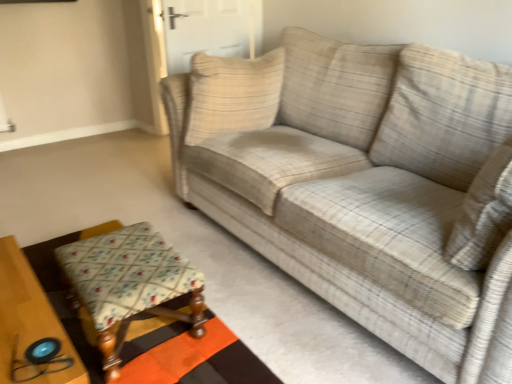
Identify the location of free space above floral fabric stool at lower left (from a real-world perspective). Image resolution: width=512 pixels, height=384 pixels. (128, 252).